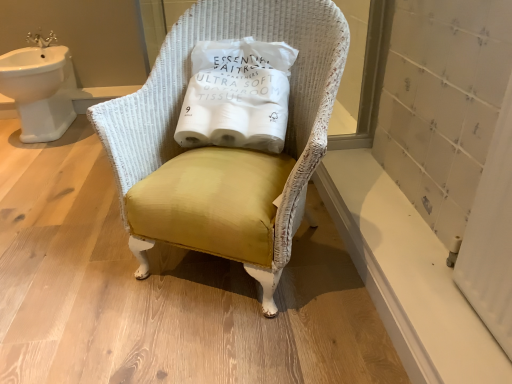
In order to click on empty space that is ontop of white smooth window sill at lower right (from a real-world perspective) in this screenshot , I will do (392, 223).